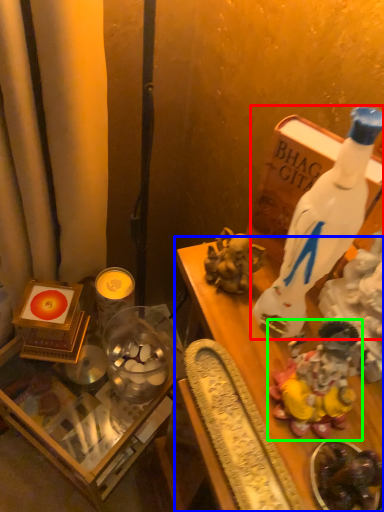
Question: Based on their relative distances, which object is nearer to bottle (highlighted by a red box)? Choose from furniture (highlighted by a blue box) and toy (highlighted by a green box).

Choices:
 (A) furniture
 (B) toy

Answer: (A)